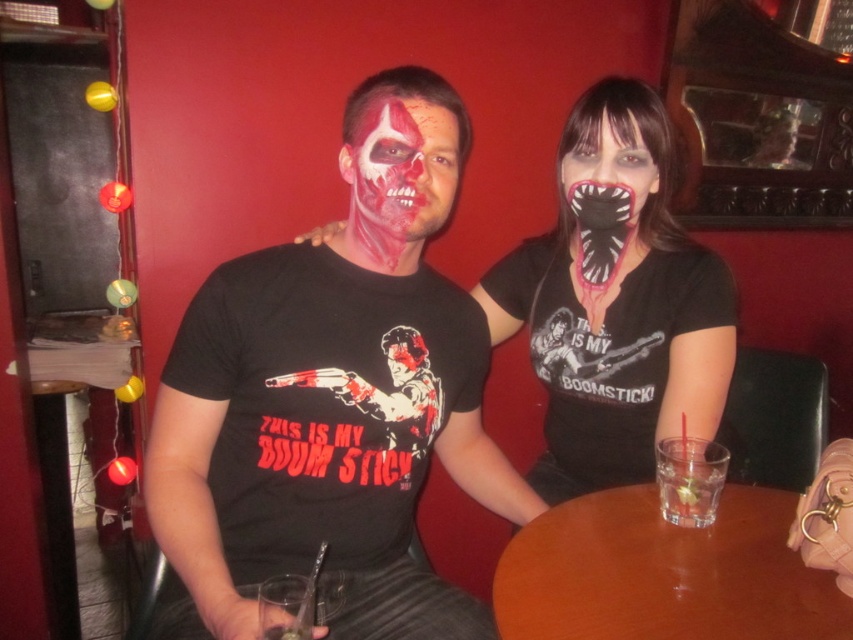
Which is more to the right, matte black t-shirt at center or brown wooden table at center?

Positioned to the right is brown wooden table at center.

Which of these two, matte black t-shirt at center or brown wooden table at center, stands taller?

matte black t-shirt at center

At what (x,y) coordinates should I click in order to perform the action: click on matte black t-shirt at center. Please return your answer as a coordinate pair (x, y). Looking at the image, I should click on (335, 394).

Who is more distant from viewer, [260,356] or [657,388]?

The point [657,388] is behind.

Find the location of `matte black t-shirt at center`. matte black t-shirt at center is located at coordinates (335, 394).

Is point (241, 371) positioned in front of point (561, 435)?

Yes, point (241, 371) is in front of point (561, 435).

The image size is (853, 640). In order to click on matte black t-shirt at center in this screenshot , I will do `click(335, 394)`.

Does matte black t-shirt at center have a greater height compared to black matte mask at center?

Indeed, matte black t-shirt at center has a greater height compared to black matte mask at center.

Is matte black t-shirt at center to the right of black matte mask at center from the viewer's perspective?

No, matte black t-shirt at center is not to the right of black matte mask at center.

Find the location of `matte black t-shirt at center`. matte black t-shirt at center is located at coordinates (335, 394).

At what (x,y) coordinates should I click in order to perform the action: click on matte black t-shirt at center. Please return your answer as a coordinate pair (x, y). The image size is (853, 640). Looking at the image, I should click on (335, 394).